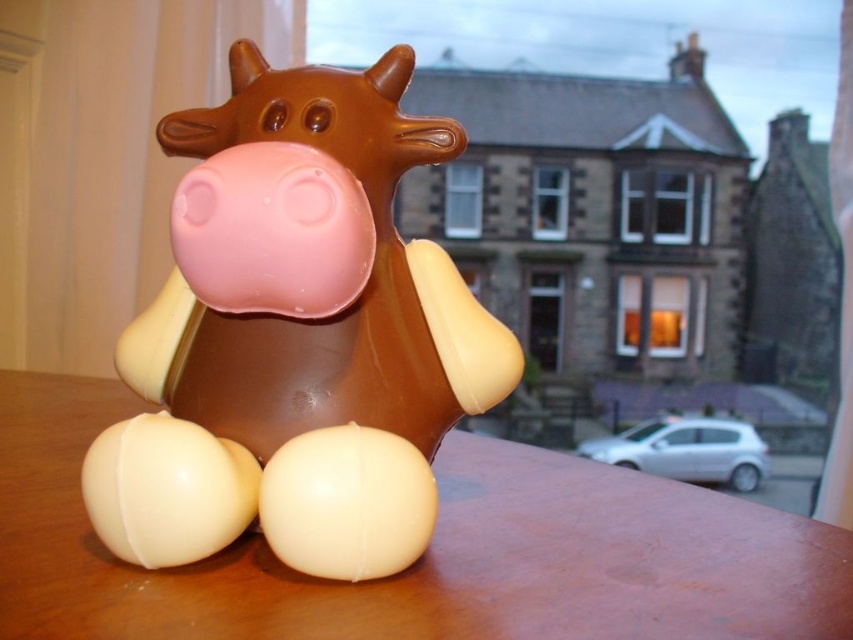
Question: Does matte chocolate cow at center have a smaller size compared to wooden table at center?

Choices:
 (A) yes
 (B) no

Answer: (A)

Question: Which object is farther from the camera taking this photo?

Choices:
 (A) matte chocolate cow at center
 (B) wooden table at center

Answer: (A)

Question: Is matte chocolate cow at center bigger than wooden table at center?

Choices:
 (A) no
 (B) yes

Answer: (A)

Question: Among these objects, which one is farthest from the camera?

Choices:
 (A) wooden table at center
 (B) matte chocolate cow at center

Answer: (B)

Question: Can you confirm if matte chocolate cow at center is positioned to the right of wooden table at center?

Choices:
 (A) yes
 (B) no

Answer: (A)

Question: Which of the following is the closest to the observer?

Choices:
 (A) (572, 525)
 (B) (277, 512)

Answer: (B)